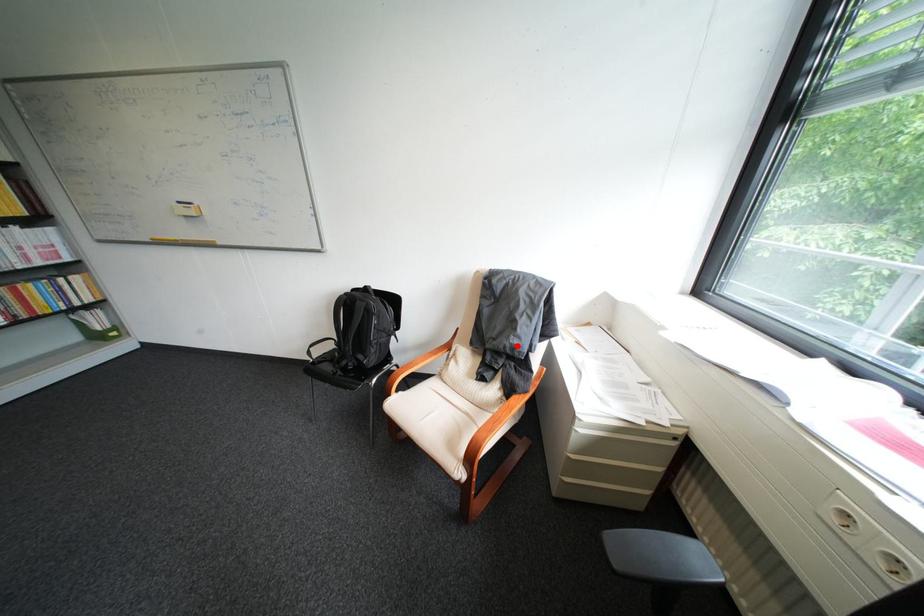
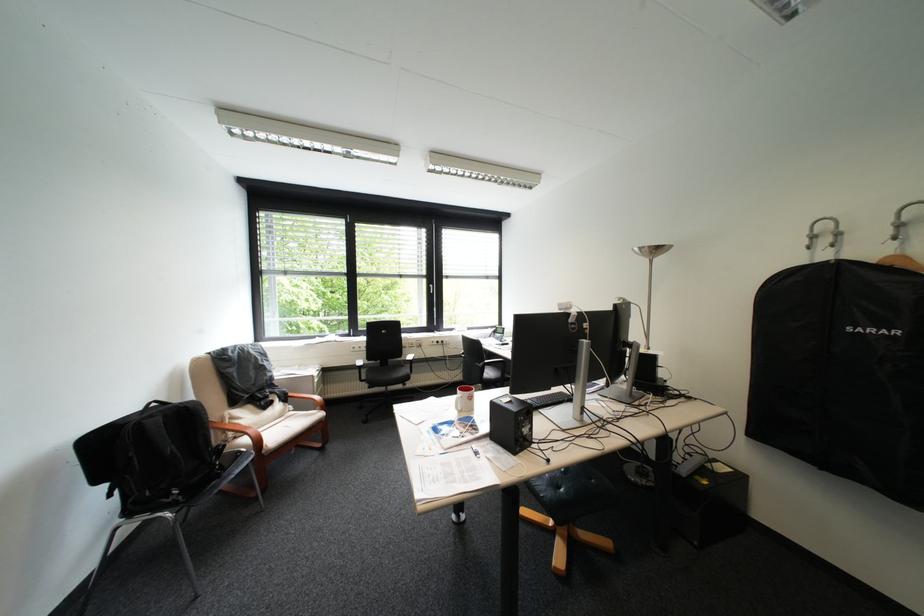
In the second image, find the point that corresponds to the highlighted location in the first image.

(280, 381)